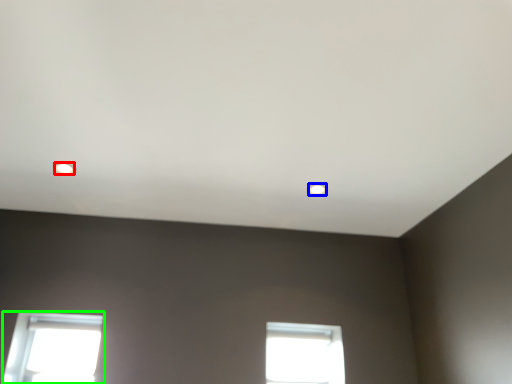
Question: Based on their relative distances, which object is nearer to lighting (highlighted by a red box)? Choose from lighting (highlighted by a blue box) and window (highlighted by a green box).

Choices:
 (A) lighting
 (B) window

Answer: (B)